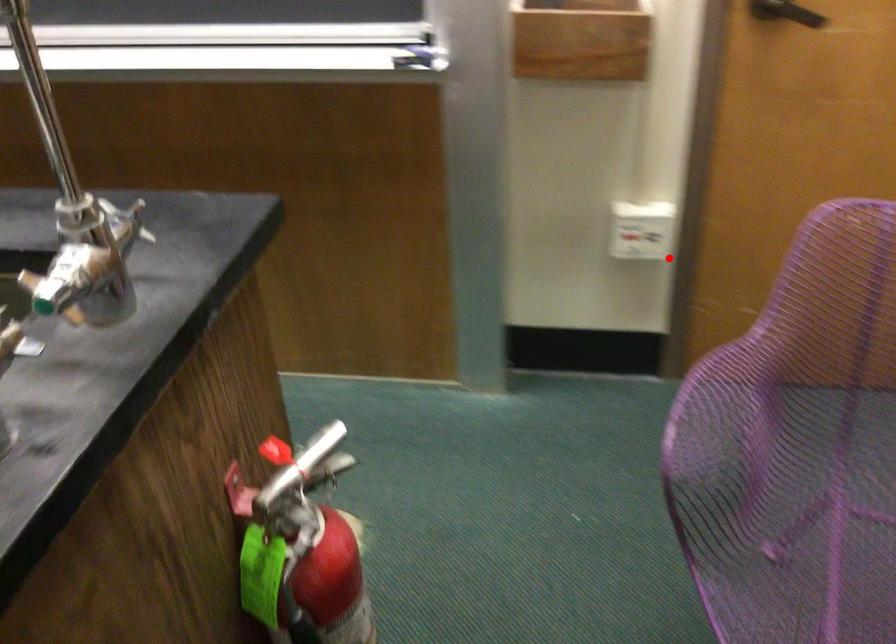
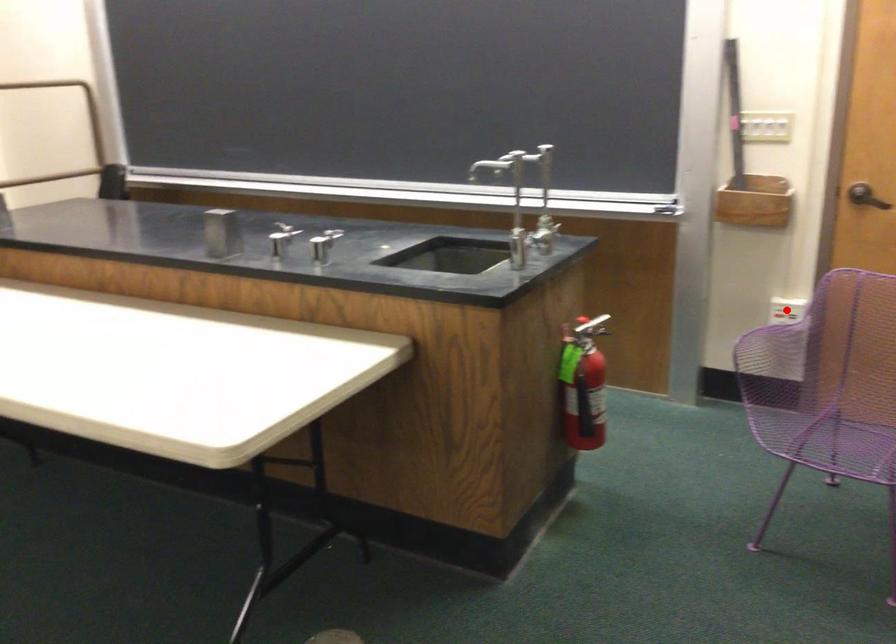
I am providing you with two images of the same scene from different viewpoints. A red point is marked on the first image and another point is marked on the second image. Does the point marked in image1 correspond to the same location as the one in image2?

Yes